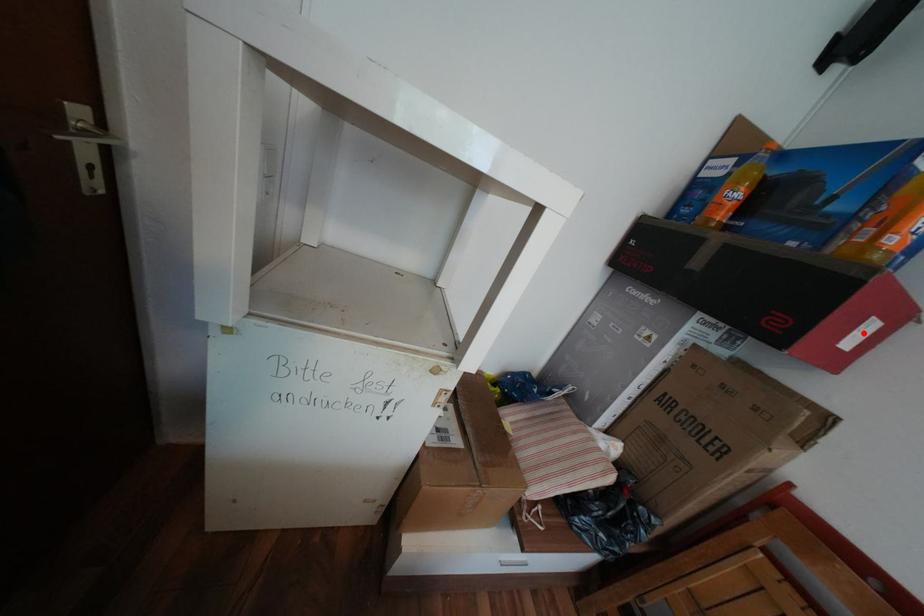
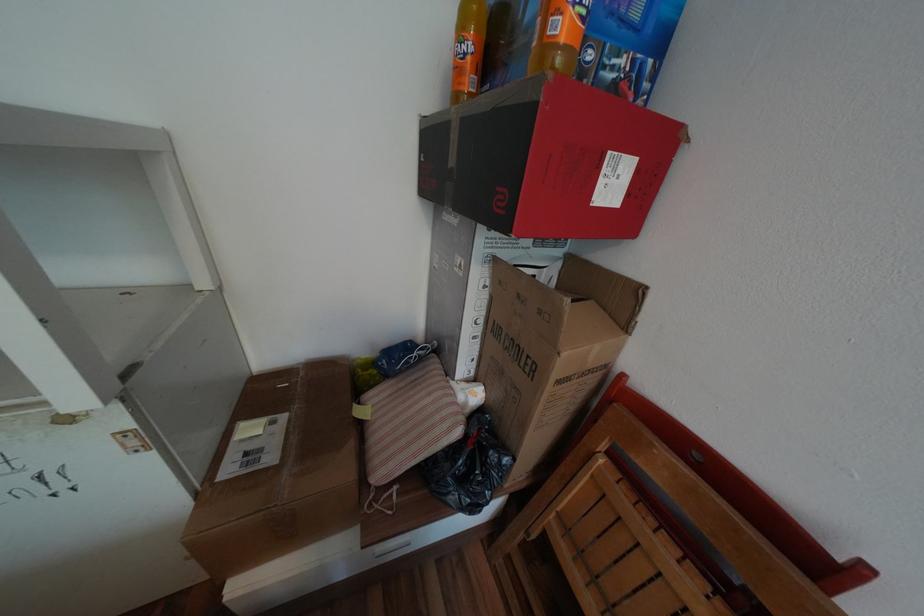
Find the pixel in the second image that matches the highlighted location in the first image.

(611, 182)